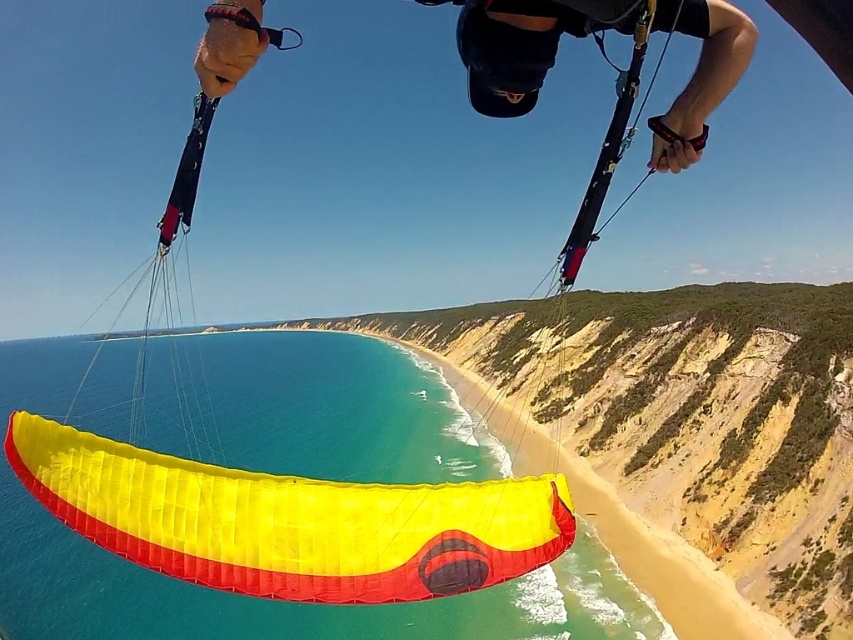
You are a paraglider pilot preparing to land. You notice two yellow fabric items in your view. The yellow fabric parachute at center and the yellow fabric parasail at lower center. Which item is closer to you based on their positions?

The yellow fabric parasail at lower center is closer to you because it is positioned lower in your field of view compared to the yellow fabric parachute at center.

You are a paraglider pilot preparing to land. You notice a point marked at coordinates (234, 541) in your visual field. Your landing zone must be within 40 meters to ensure a safe landing. Can you confirm if this point is within the safe distance?

The point at coordinates (234, 541) is 39.54 meters away from the camera, which is within the 40 meters safe distance required for landing. Therefore, it is safe to land there.

You are a paraglider pilot preparing to land. You notice two yellow fabric objects below you. Which one is higher in the sky between the yellow fabric parachute at center and the yellow fabric parasail at lower center?

The yellow fabric parachute at center is higher in the sky than the yellow fabric parasail at lower center because it has a greater height compared to it.